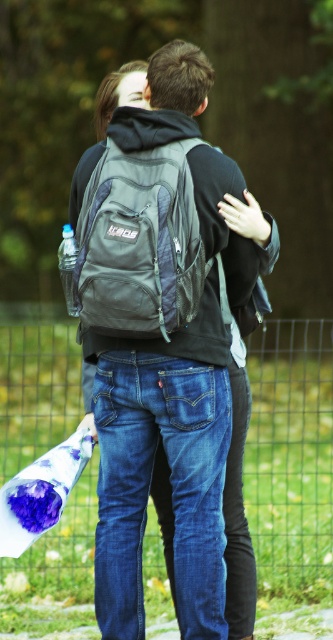
You are standing at the point marked as point (149, 477) in the image. You want to move to the nearest exit, which is located 10 meters behind you. Can you walk straight back from your current position to reach the exit without any obstacles?

The distance between point (149, 477) and the viewer is 5.02 meters. Since the exit is 10 meters behind you, you are still 4.98 meters away from the exit. However, the image does not provide information about any obstacles between your current position and the exit, so it is possible to walk straight back.

Based on the scene description, where is the wire mesh fence at center located in the image?

The wire mesh fence at center is located at point coordinates of (290, 456) in the image.

You are standing in the park and see two points marked in the image. Which point is closer to you, point (88, 516) or point (73, 248)?

Point (88, 516) is closer to you because it is further to the camera than point (73, 248).